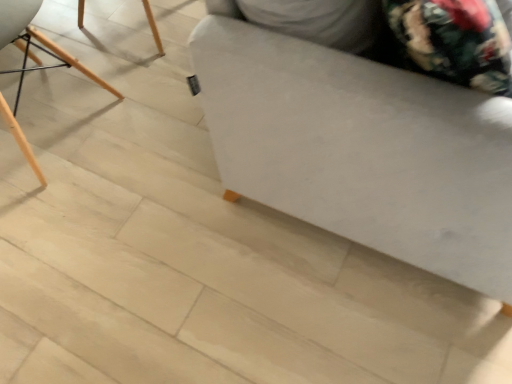
Identify the location of free space to the right of wooden chair at left. (166, 144).